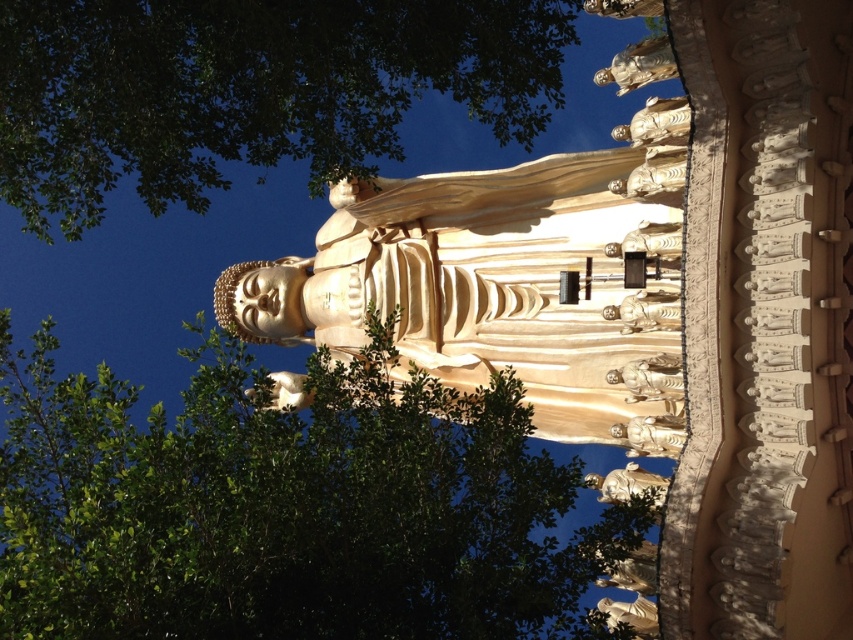
Who is more forward, (677,371) or (675,448)?

Point (675,448) is in front.

Between smooth beige statue at center and gold polished statue at center, which one appears on the left side from the viewer's perspective?

Positioned to the left is gold polished statue at center.

Where is `smooth beige statue at center`? smooth beige statue at center is located at coordinates (650, 378).

Identify the location of smooth beige statue at center. (650, 378).

Which is below, smooth beige statue at center or gold polished statue at lower right?

gold polished statue at lower right is below.

Is smooth beige statue at center behind gold polished statue at lower right?

No.

The image size is (853, 640). Describe the element at coordinates (650, 378) in the screenshot. I see `smooth beige statue at center` at that location.

Find the location of a particular element. smooth beige statue at center is located at coordinates tap(650, 378).

How far apart are gold textured statue at center and gold polished statue at center?

A distance of 14.77 meters exists between gold textured statue at center and gold polished statue at center.

Is gold textured statue at center smaller than gold polished statue at center?

No, gold textured statue at center is not smaller than gold polished statue at center.

This screenshot has height=640, width=853. What are the coordinates of `gold textured statue at center` in the screenshot? It's located at [654, 173].